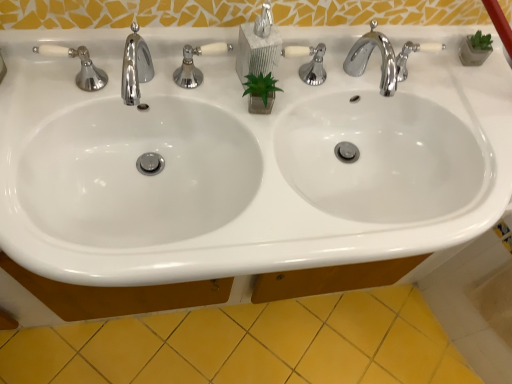
What are the coordinates of `vacant region to the left of polished chrome faucet at upper right, acting as the second tap starting from the left` in the screenshot? It's located at (302, 89).